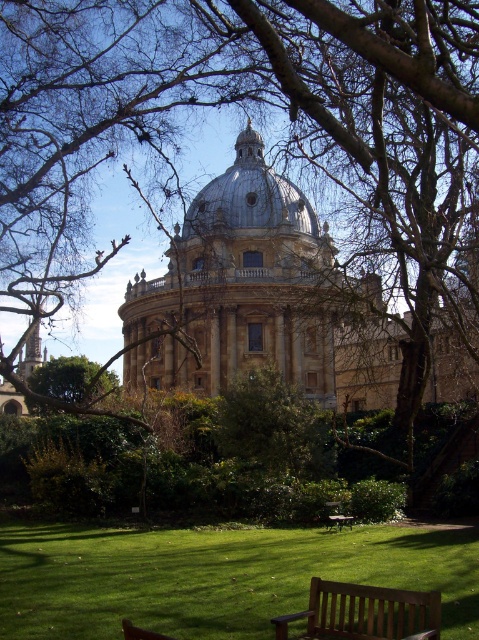
You are planning to take a photo of the golden stone dome at center and the brown wooden bench at lower center from a position where both are visible. Based on their positions, which object should appear higher in the photo?

The golden stone dome at center appears higher in the photo because it is located above the brown wooden bench at lower center.